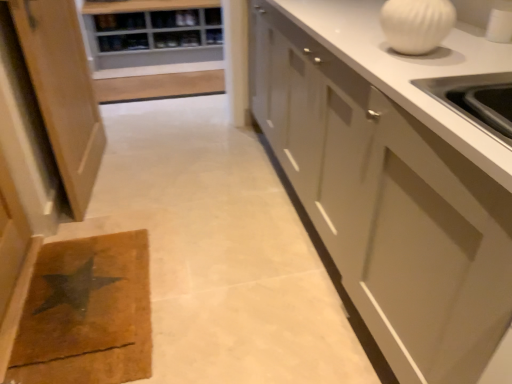
Where is `free region under white glossy vase at upper right (from a real-world perspective)`? Image resolution: width=512 pixels, height=384 pixels. free region under white glossy vase at upper right (from a real-world perspective) is located at coordinates (411, 52).